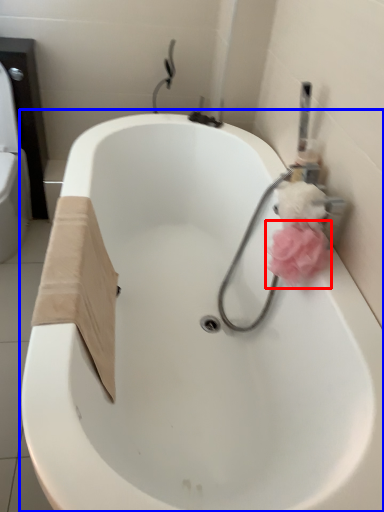
Question: Which point is closer to the camera, flower (highlighted by a red box) or bathtub (highlighted by a blue box)?

Choices:
 (A) flower
 (B) bathtub

Answer: (B)